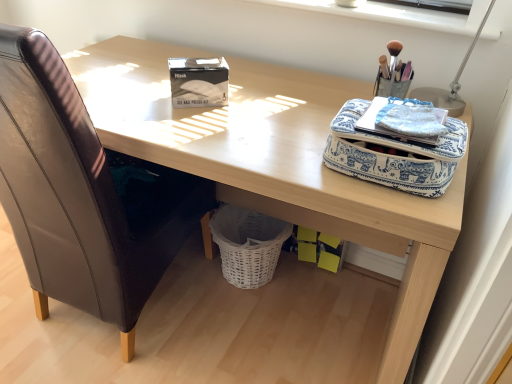
Question: Does metallic silver table lamp at upper right have a smaller size compared to blue printed fabric bag at upper right?

Choices:
 (A) no
 (B) yes

Answer: (A)

Question: Does metallic silver table lamp at upper right come behind blue printed fabric bag at upper right?

Choices:
 (A) yes
 (B) no

Answer: (A)

Question: Can we say metallic silver table lamp at upper right lies outside blue printed fabric bag at upper right?

Choices:
 (A) no
 (B) yes

Answer: (B)

Question: From the image's perspective, does metallic silver table lamp at upper right appear lower than blue printed fabric bag at upper right?

Choices:
 (A) yes
 (B) no

Answer: (B)

Question: Is metallic silver table lamp at upper right shorter than blue printed fabric bag at upper right?

Choices:
 (A) yes
 (B) no

Answer: (B)

Question: From the image's perspective, relative to white wicker basket at lower center, is wooden desk at center above or below?

Choices:
 (A) above
 (B) below

Answer: (A)

Question: Is point (302, 112) positioned closer to the camera than point (216, 215)?

Choices:
 (A) closer
 (B) farther

Answer: (A)

Question: Is wooden desk at center inside the boundaries of white wicker basket at lower center, or outside?

Choices:
 (A) outside
 (B) inside

Answer: (A)

Question: Considering the relative positions of wooden desk at center and white wicker basket at lower center in the image provided, is wooden desk at center to the left or to the right of white wicker basket at lower center?

Choices:
 (A) left
 (B) right

Answer: (A)

Question: Is point (455, 99) positioned closer to the camera than point (253, 246)?

Choices:
 (A) farther
 (B) closer

Answer: (B)

Question: Considering the positions of metallic silver table lamp at upper right and white wicker basket at lower center in the image, is metallic silver table lamp at upper right wider or thinner than white wicker basket at lower center?

Choices:
 (A) thin
 (B) wide

Answer: (A)

Question: Is metallic silver table lamp at upper right to the left or to the right of white wicker basket at lower center in the image?

Choices:
 (A) right
 (B) left

Answer: (A)

Question: From a real-world perspective, is metallic silver table lamp at upper right positioned above or below white wicker basket at lower center?

Choices:
 (A) below
 (B) above

Answer: (B)

Question: Considering the positions of metallic silver table lamp at upper right and white plastic at upper center in the image, is metallic silver table lamp at upper right wider or thinner than white plastic at upper center?

Choices:
 (A) thin
 (B) wide

Answer: (A)

Question: Does point (494, 3) appear closer or farther from the camera than point (457, 21)?

Choices:
 (A) closer
 (B) farther

Answer: (A)